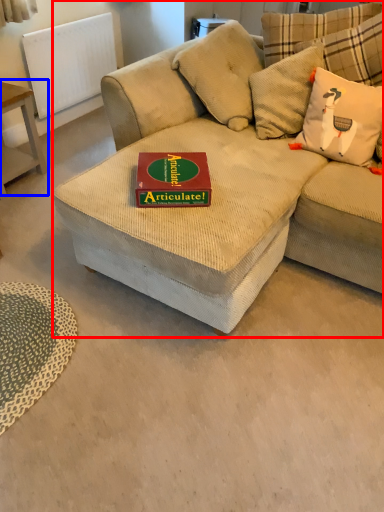
Question: Which object appears closest to the camera in this image, studio couch (highlighted by a red box) or table (highlighted by a blue box)?

Choices:
 (A) studio couch
 (B) table

Answer: (A)